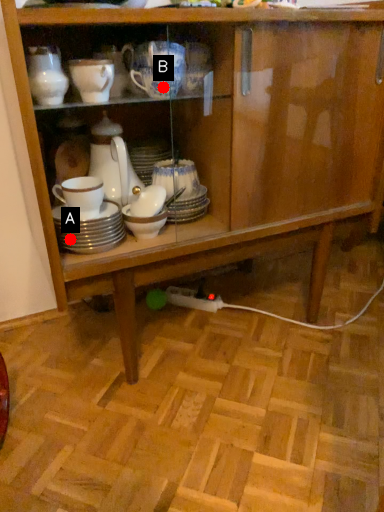
Question: Two points are circled on the image, labeled by A and B beside each circle. Among these points, which one is nearest to the camera?

Choices:
 (A) A is closer
 (B) B is closer

Answer: (B)